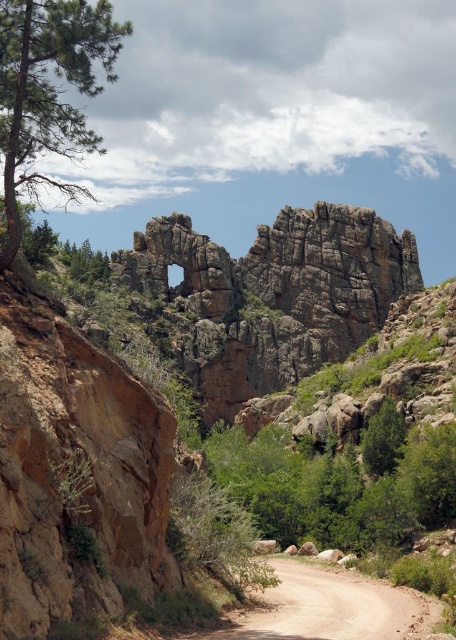
The image size is (456, 640). Identify the location of green matte tree at left. [48, 93].

Which is in front, point (60, 52) or point (419, 634)?

Positioned in front is point (419, 634).

At what (x,y) coordinates should I click in order to perform the action: click on green matte tree at left. Please return your answer as a coordinate pair (x, y). The width and height of the screenshot is (456, 640). Looking at the image, I should click on (48, 93).

This screenshot has width=456, height=640. What are the coordinates of `green leafy tree at center` in the screenshot? It's located at (341, 483).

Who is positioned more to the left, green leafy tree at center or green matte tree at left?

green matte tree at left is more to the left.

Who is more forward, (384, 484) or (0, 125)?

Point (0, 125) is more forward.

I want to click on green leafy tree at center, so click(x=341, y=483).

Does green leafy tree at center appear over brown dirt track at center?

Indeed, green leafy tree at center is positioned over brown dirt track at center.

Who is positioned more to the left, green leafy tree at center or brown dirt track at center?

Positioned to the left is green leafy tree at center.

At what (x,y) coordinates should I click in order to perform the action: click on green leafy tree at center. Please return your answer as a coordinate pair (x, y). Looking at the image, I should click on (341, 483).